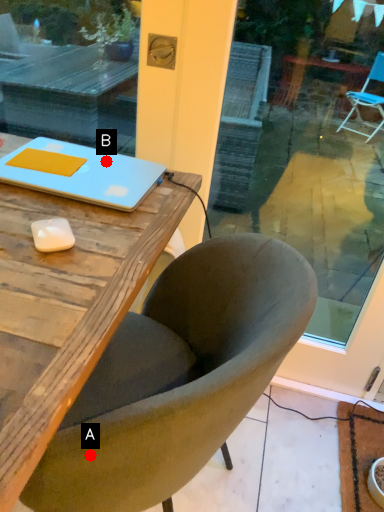
Question: Two points are circled on the image, labeled by A and B beside each circle. Which point is closer to the camera?

Choices:
 (A) A is closer
 (B) B is closer

Answer: (A)